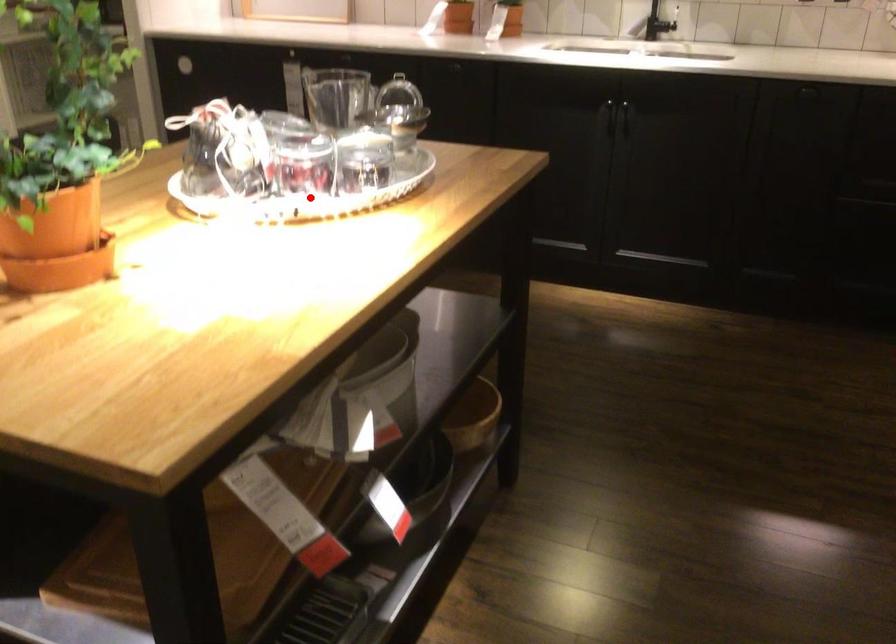
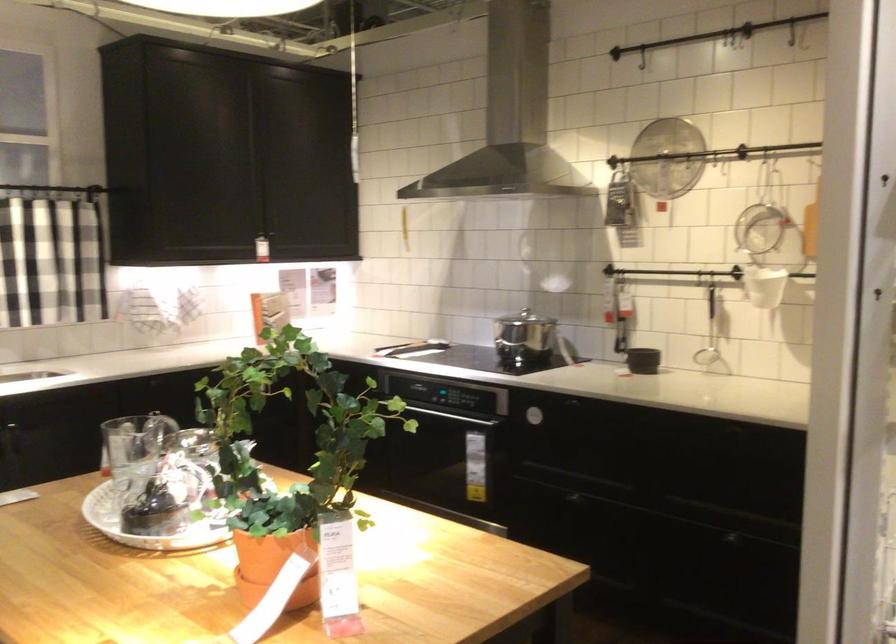
Question: I am providing you with two images of the same scene from different viewpoints. A red point is marked on the first image. Can you still see the location of the red point in image 2?

Choices:
 (A) Yes
 (B) No

Answer: (B)